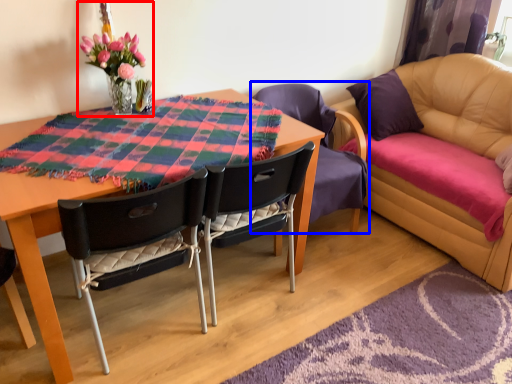
Question: Which object appears closest to the camera in this image, floral arrangement (highlighted by a red box) or chair (highlighted by a blue box)?

Choices:
 (A) floral arrangement
 (B) chair

Answer: (A)